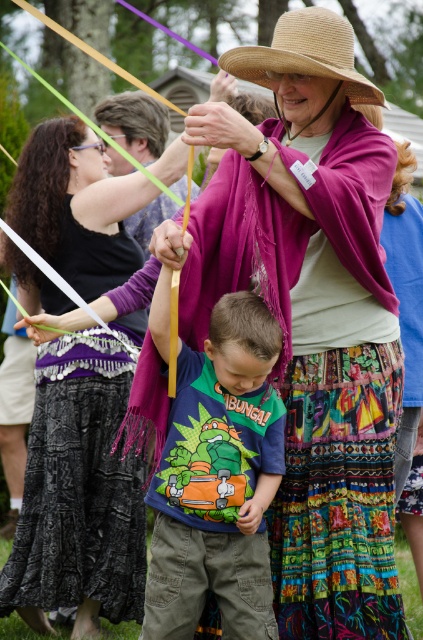
Does black textured skirt at lower left appear over matte green t-shirt at center?

Actually, black textured skirt at lower left is below matte green t-shirt at center.

Is point (19, 545) positioned before point (161, 556)?

No, it is behind (161, 556).

Which is behind, point (25, 540) or point (247, 532)?

Point (25, 540)

Locate an element on the screen. The height and width of the screenshot is (640, 423). black textured skirt at lower left is located at coordinates [79, 488].

Does purple scarf at center appear under matte green t-shirt at center?

Yes.

At what (x,y) coordinates should I click in order to perform the action: click on purple scarf at center. Please return your answer as a coordinate pair (x, y). The height and width of the screenshot is (640, 423). Looking at the image, I should click on (79, 499).

At what (x,y) coordinates should I click in order to perform the action: click on purple scarf at center. Please return your answer as a coordinate pair (x, y). This screenshot has width=423, height=640. Looking at the image, I should click on (79, 499).

Locate an element on the screen. purple scarf at center is located at coordinates (79, 499).

Which of these two, black textured skirt at lower left or straw hat at upper center, stands shorter?

Standing shorter between the two is straw hat at upper center.

Describe the element at coordinates (79, 488) in the screenshot. I see `black textured skirt at lower left` at that location.

Is point (142, 563) in front of point (310, 64)?

No.

This screenshot has width=423, height=640. Find the location of `black textured skirt at lower left`. black textured skirt at lower left is located at coordinates (79, 488).